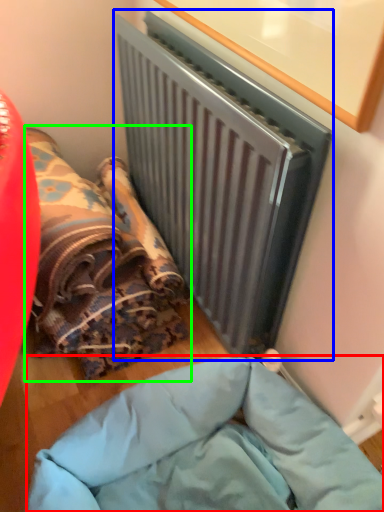
Question: Considering the real-world distances, which object is farthest from furniture (highlighted by a red box)? radiator (highlighted by a blue box) or bean bag chair (highlighted by a green box)?

Choices:
 (A) radiator
 (B) bean bag chair

Answer: (A)